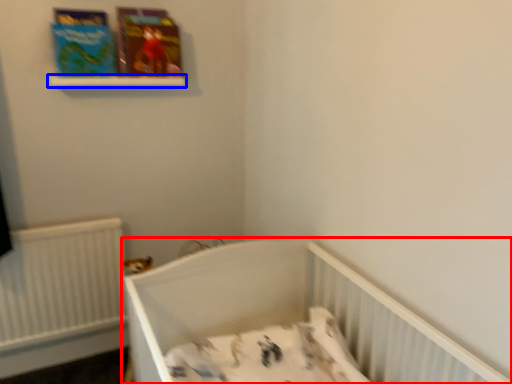
Question: Which of the following is the closest to the observer, infant bed (highlighted by a red box) or balustrade (highlighted by a blue box)?

Choices:
 (A) infant bed
 (B) balustrade

Answer: (A)